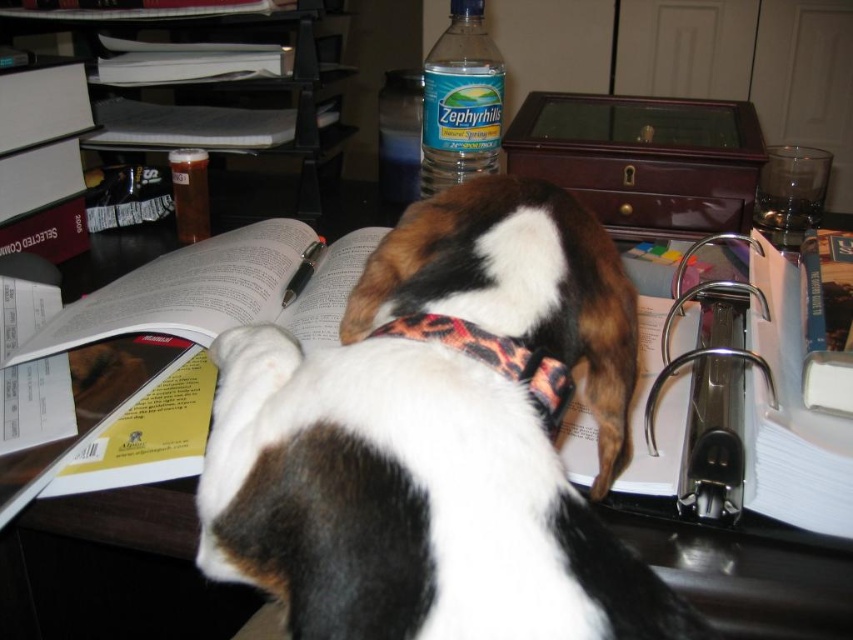
The height and width of the screenshot is (640, 853). Find the location of `brown and white fur at center`. brown and white fur at center is located at coordinates (440, 438).

Can you confirm if brown and white fur at center is positioned to the left of black plastic file at upper left?

Incorrect, brown and white fur at center is not on the left side of black plastic file at upper left.

Image resolution: width=853 pixels, height=640 pixels. What do you see at coordinates (440, 438) in the screenshot? I see `brown and white fur at center` at bounding box center [440, 438].

Image resolution: width=853 pixels, height=640 pixels. Identify the location of brown and white fur at center. (440, 438).

Is black plastic file at upper left thinner than leopard print fabric neckband at center?

Incorrect, black plastic file at upper left's width is not less than leopard print fabric neckband at center's.

Does black plastic file at upper left come in front of leopard print fabric neckband at center?

No, it is behind leopard print fabric neckband at center.

Is point (257, 132) positioned in front of point (433, 320)?

No, (257, 132) is behind (433, 320).

Image resolution: width=853 pixels, height=640 pixels. I want to click on black plastic file at upper left, so click(193, 86).

Is black plastic file at upper left below clear plastic bottle at upper center?

Incorrect, black plastic file at upper left is not positioned below clear plastic bottle at upper center.

Can you confirm if black plastic file at upper left is smaller than clear plastic bottle at upper center?

No.

Is point (297, 26) in front of point (428, 156)?

No, it is behind (428, 156).

Identify the location of black plastic file at upper left. The height and width of the screenshot is (640, 853). (193, 86).